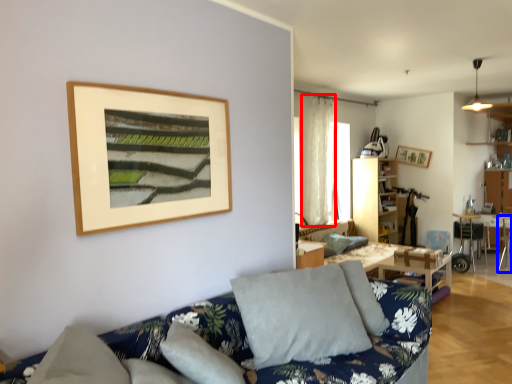
Question: Among these objects, which one is farthest to the camera, curtain (highlighted by a red box) or armchair (highlighted by a blue box)?

Choices:
 (A) curtain
 (B) armchair

Answer: (B)